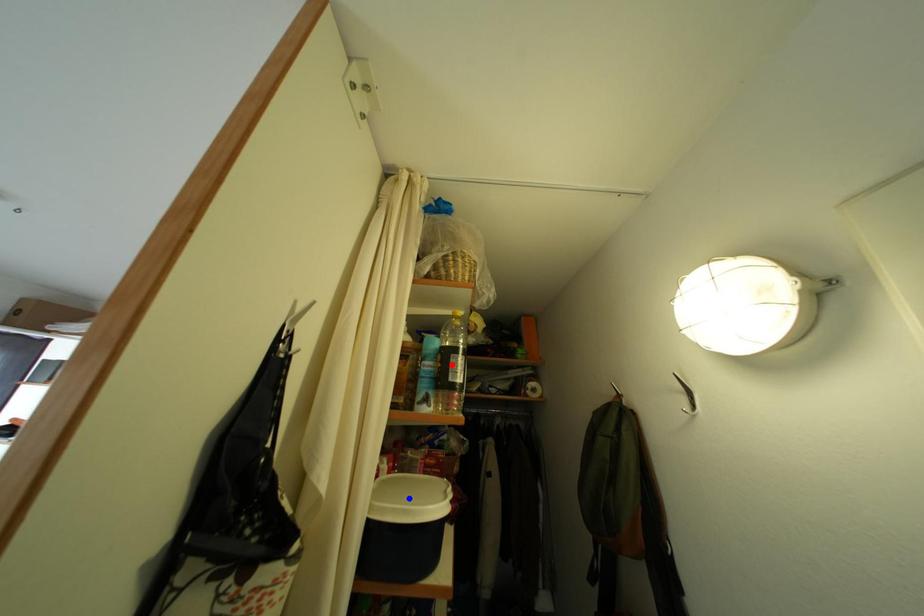
Question: Two points are marked on the image. Which point is closer to the camera?

Choices:
 (A) Blue point is closer.
 (B) Red point is closer.

Answer: (B)